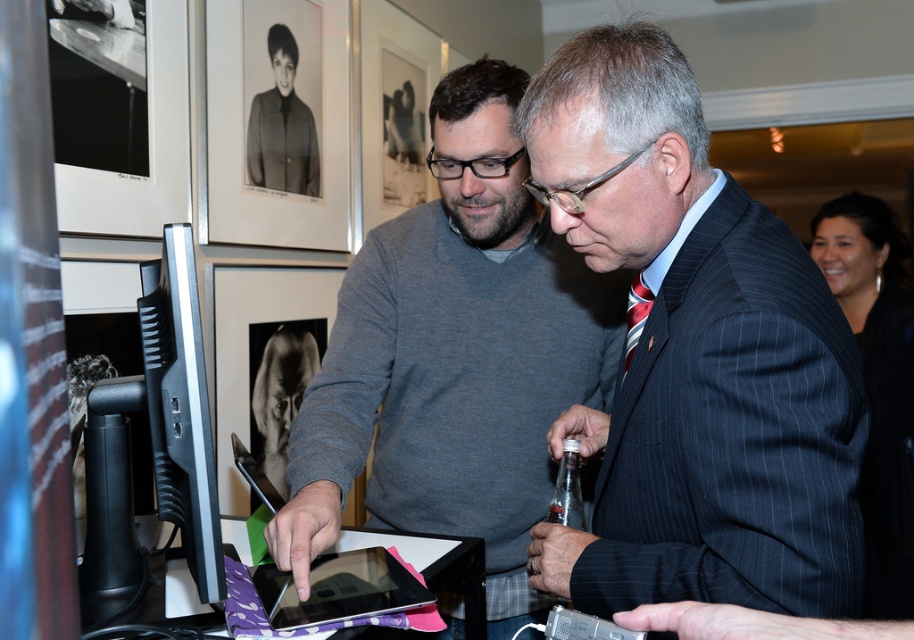
Question: Does striped suit at center appear under black glossy tablet at center?

Choices:
 (A) no
 (B) yes

Answer: (A)

Question: Can you confirm if black glossy tablet at center is positioned above matte black jacket at upper left?

Choices:
 (A) no
 (B) yes

Answer: (A)

Question: Among these points, which one is farthest from the camera?

Choices:
 (A) (303, 163)
 (B) (278, 579)
 (C) (703, 596)
 (D) (383, 312)

Answer: (A)

Question: Which point is farther from the camera taking this photo?

Choices:
 (A) (365, 605)
 (B) (285, 72)
 (C) (727, 561)

Answer: (B)

Question: Which of the following is the farthest from the observer?

Choices:
 (A) (717, 202)
 (B) (362, 605)

Answer: (B)

Question: Does gray sweater at center appear under black glossy tablet at center?

Choices:
 (A) yes
 (B) no

Answer: (B)